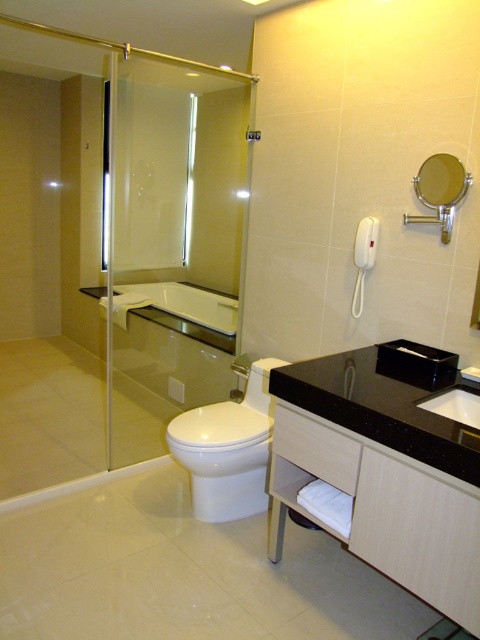
Is transparent glass shower door at left positioned behind black granite sink at center?

Yes, transparent glass shower door at left is behind black granite sink at center.

Can you confirm if transparent glass shower door at left is positioned to the left of black granite sink at center?

Correct, you'll find transparent glass shower door at left to the left of black granite sink at center.

The width and height of the screenshot is (480, 640). In order to click on transparent glass shower door at left in this screenshot , I will do `click(113, 248)`.

Does point (249, 392) come closer to viewer compared to point (228, 305)?

Yes, point (249, 392) is closer to viewer.

This screenshot has width=480, height=640. What do you see at coordinates (228, 449) in the screenshot?
I see `white glossy toilet at center` at bounding box center [228, 449].

Which is behind, point (244, 433) or point (225, 300)?

The point (225, 300) is behind.

Find the location of `white glossy toilet at center`. white glossy toilet at center is located at coordinates (228, 449).

Can you confirm if transparent glass shower door at left is positioned to the right of silver metallic faucet at lower center?

In fact, transparent glass shower door at left is to the left of silver metallic faucet at lower center.

Can you confirm if transparent glass shower door at left is wider than silver metallic faucet at lower center?

Correct, the width of transparent glass shower door at left exceeds that of silver metallic faucet at lower center.

Identify the location of transparent glass shower door at left. [113, 248].